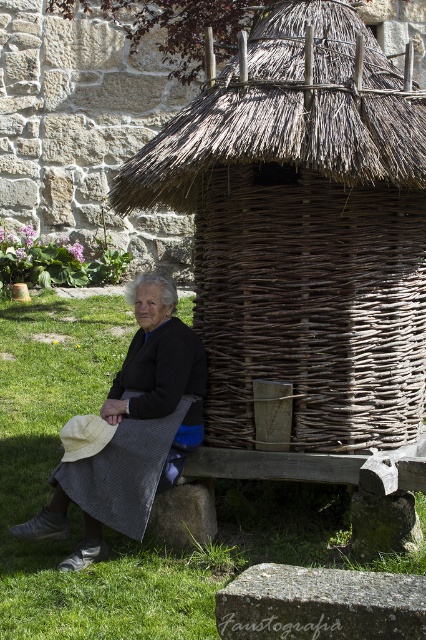
Question: Is woven brown basket at center to the right of green grass at lower left from the viewer's perspective?

Choices:
 (A) no
 (B) yes

Answer: (B)

Question: Which of the following is the closest to the observer?

Choices:
 (A) brown woven hut at center
 (B) matte black skirt at lower left

Answer: (A)

Question: Is brown woven hut at center positioned behind matte black skirt at lower left?

Choices:
 (A) yes
 (B) no

Answer: (B)

Question: Estimate the real-world distances between objects in this image. Which object is closer to the woven brown basket at center?

Choices:
 (A) brown woven hut at center
 (B) matte black skirt at lower left

Answer: (A)

Question: Does woven brown basket at center lie in front of matte black skirt at lower left?

Choices:
 (A) no
 (B) yes

Answer: (A)

Question: Which point is closer to the camera?

Choices:
 (A) (78, 545)
 (B) (258, 291)

Answer: (A)